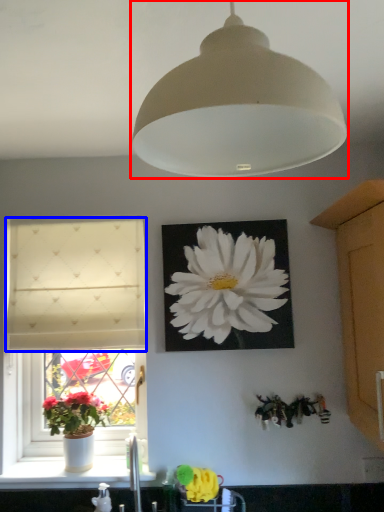
Question: Which of the following is the farthest to the observer, lamp (highlighted by a red box) or curtain (highlighted by a blue box)?

Choices:
 (A) lamp
 (B) curtain

Answer: (B)